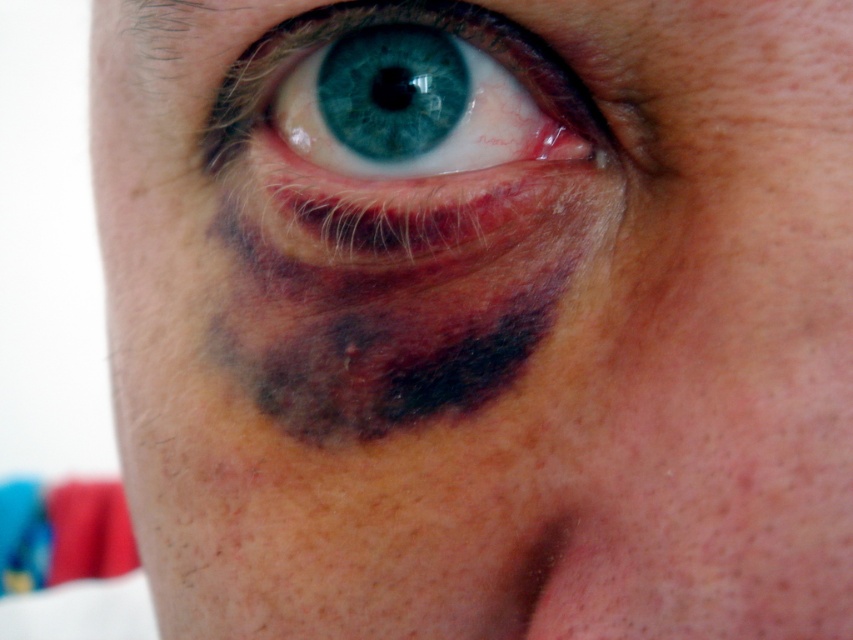
Is point (357, 352) closer to viewer compared to point (549, 68)?

No, it is not.

Which of these two, matte skin at upper center or blue matte eye at center, stands shorter?

Standing shorter between the two is blue matte eye at center.

What do you see at coordinates (482, 307) in the screenshot? I see `matte skin at upper center` at bounding box center [482, 307].

You are a GUI agent. You are given a task and a screenshot of the screen. Output one action in this format:
    pyautogui.click(x=<x>, y=<y>)
    Task: Click on the matte skin at upper center
    
    Given the screenshot: What is the action you would take?
    pyautogui.click(x=482, y=307)

Which is below, blue matte eye at center or brown hair at upper left?

blue matte eye at center is below.

Does point (300, 49) lie in front of point (151, 68)?

Yes.

The width and height of the screenshot is (853, 640). I want to click on blue matte eye at center, so click(405, 138).

Is matte skin at upper center taller than brown hair at upper left?

Yes, matte skin at upper center is taller than brown hair at upper left.

Is matte skin at upper center thinner than brown hair at upper left?

No, matte skin at upper center is not thinner than brown hair at upper left.

Where is `matte skin at upper center`? matte skin at upper center is located at coordinates (482, 307).

The width and height of the screenshot is (853, 640). Identify the location of matte skin at upper center. tap(482, 307).